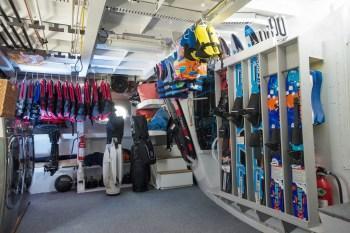
The width and height of the screenshot is (350, 233). What are the coordinates of `stand` in the screenshot? It's located at (294, 55).